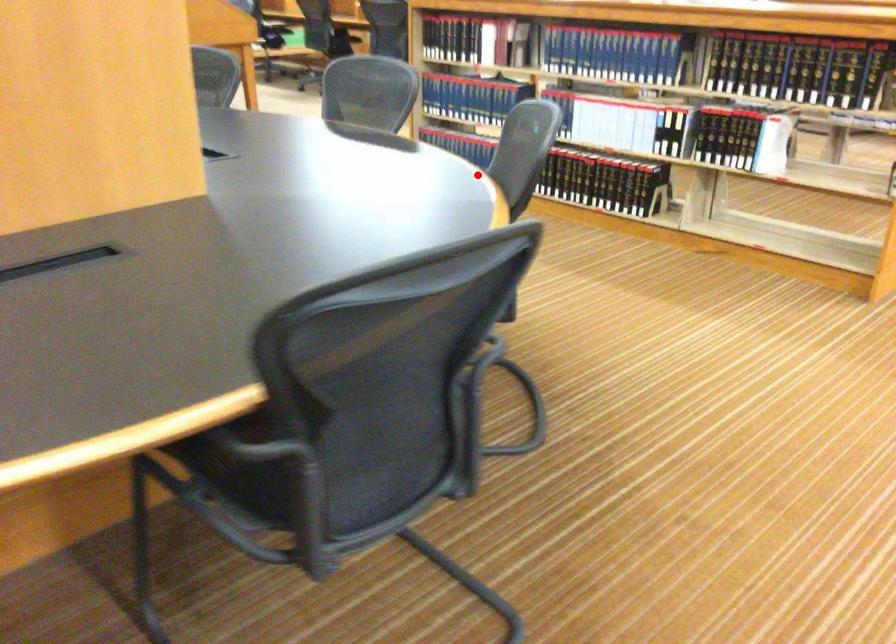
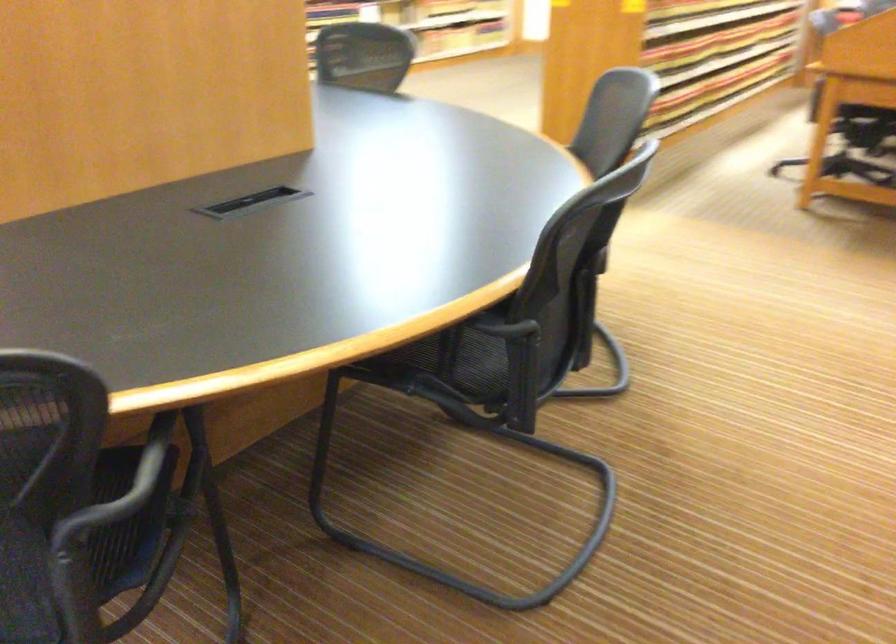
Question: I am providing you with two images of the same scene from different viewpoints. In image1, a red point is highlighted. Considering the same 3D point in image2, which of the following is correct?

Choices:
 (A) It is closer
 (B) It is farther

Answer: (A)